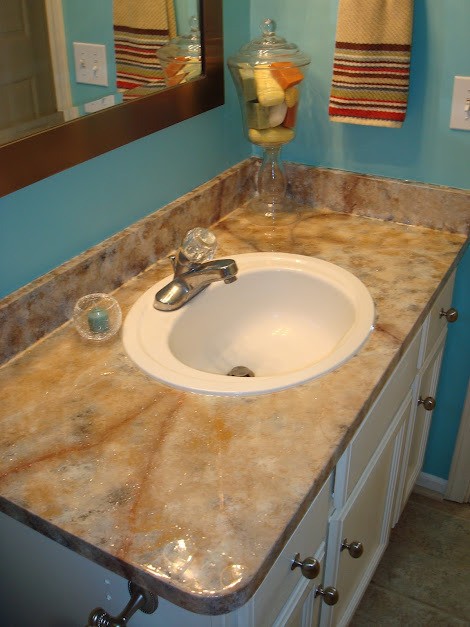
In order to click on counter top in this screenshot , I will do `click(240, 502)`.